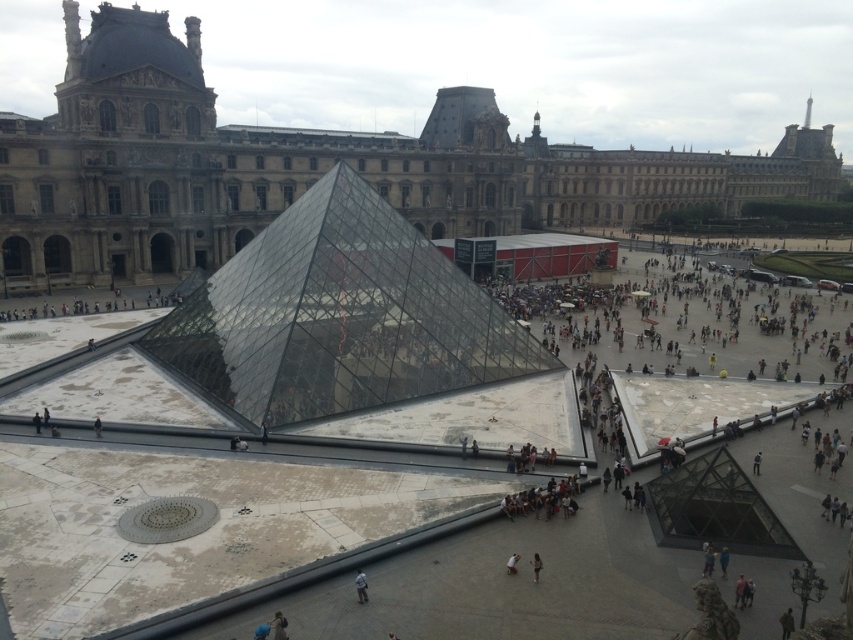
Based on the photo, you are a photographer at the Louvre Museum and want to capture a photo of the light brown fabric dress at center and the white fabric person at center. Which object is closer to the camera?

The light brown fabric dress at center is positioned under the white fabric person at center, so the white fabric person at center is closer to the camera.

You are an artist standing in the plaza of the Louvre Museum, observing the light brown fabric dress at center and the white fabric person at center. Which object is wider?

The white fabric person at center is wider than the light brown fabric dress at center.